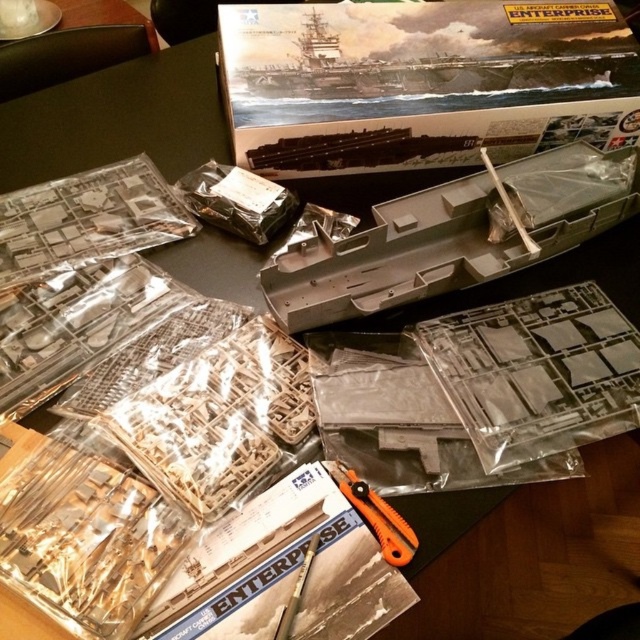
Question: Observing the image, what is the correct spatial positioning of gray plastic boat at center in reference to orange plastic scissors at center?

Choices:
 (A) left
 (B) right

Answer: (B)

Question: Which point is closer to the camera taking this photo?

Choices:
 (A) (296, 291)
 (B) (385, 513)

Answer: (B)

Question: In this image, where is gray plastic boat at center located relative to orange plastic scissors at center?

Choices:
 (A) below
 (B) above

Answer: (B)

Question: Is gray plastic boat at center positioned at the back of orange plastic scissors at center?

Choices:
 (A) no
 (B) yes

Answer: (B)